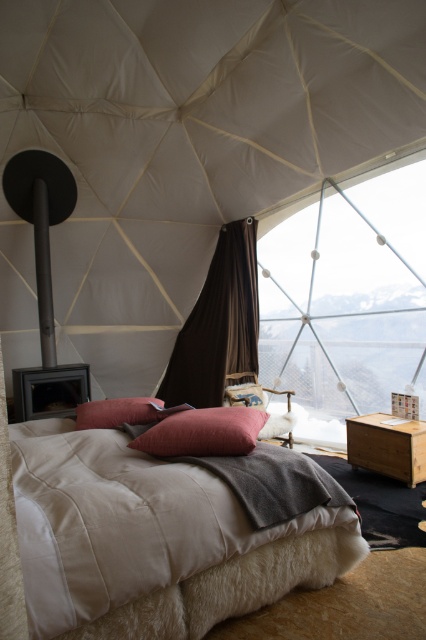
Question: Is beige cotton bed at center to the right of matte pink pillow at center from the viewer's perspective?

Choices:
 (A) no
 (B) yes

Answer: (A)

Question: Which object appears farthest from the camera in this image?

Choices:
 (A) beige cotton bed at center
 (B) transparent glass window at upper center
 (C) brown wooden dresser at right
 (D) white fabric canopy at upper center

Answer: (B)

Question: Among these points, which one is nearest to the camera?

Choices:
 (A) (244, 291)
 (B) (25, 454)
 (C) (152, 442)

Answer: (C)

Question: Is white fabric canopy at upper center to the left of beige cotton bed at center from the viewer's perspective?

Choices:
 (A) yes
 (B) no

Answer: (A)

Question: Estimate the real-world distances between objects in this image. Which object is farther from the beige cotton bed at center?

Choices:
 (A) pink velvet pillow at center
 (B) brown wooden dresser at right
 (C) brown fabric curtain at center
 (D) white fabric canopy at upper center

Answer: (D)

Question: Is beige cotton bed at center above brown fabric curtain at center?

Choices:
 (A) no
 (B) yes

Answer: (A)